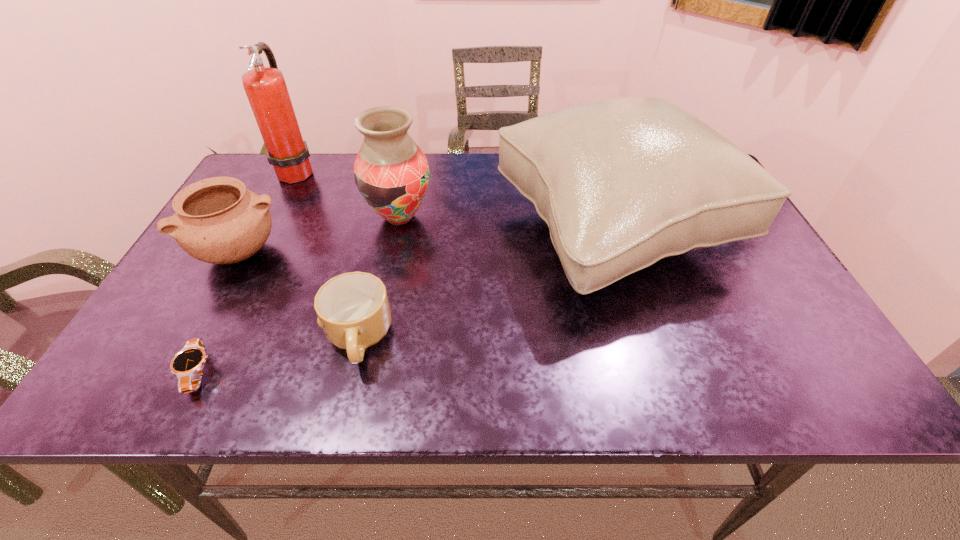
Where is `free region located on the back of the shortest object`? free region located on the back of the shortest object is located at coordinates (235, 300).

Find the location of `fire extinguisher that is at the far edge`. fire extinguisher that is at the far edge is located at coordinates (265, 87).

Locate an element on the screen. This screenshot has width=960, height=540. cushion that is at the far edge is located at coordinates (624, 182).

Image resolution: width=960 pixels, height=540 pixels. I want to click on vase that is at the far edge, so click(391, 172).

I want to click on mug situated at the near edge, so click(x=353, y=309).

Find the location of a particular element. Image resolution: width=960 pixels, height=540 pixels. watch situated at the near edge is located at coordinates (187, 364).

Where is `fire extinguisher that is at the left edge`? The image size is (960, 540). fire extinguisher that is at the left edge is located at coordinates (265, 87).

Identify the location of pottery located at the left edge. (217, 220).

This screenshot has height=540, width=960. Identify the location of watch that is at the left edge. (187, 364).

This screenshot has height=540, width=960. Find the location of `object located in the right edge section of the desktop`. object located in the right edge section of the desktop is located at coordinates (624, 182).